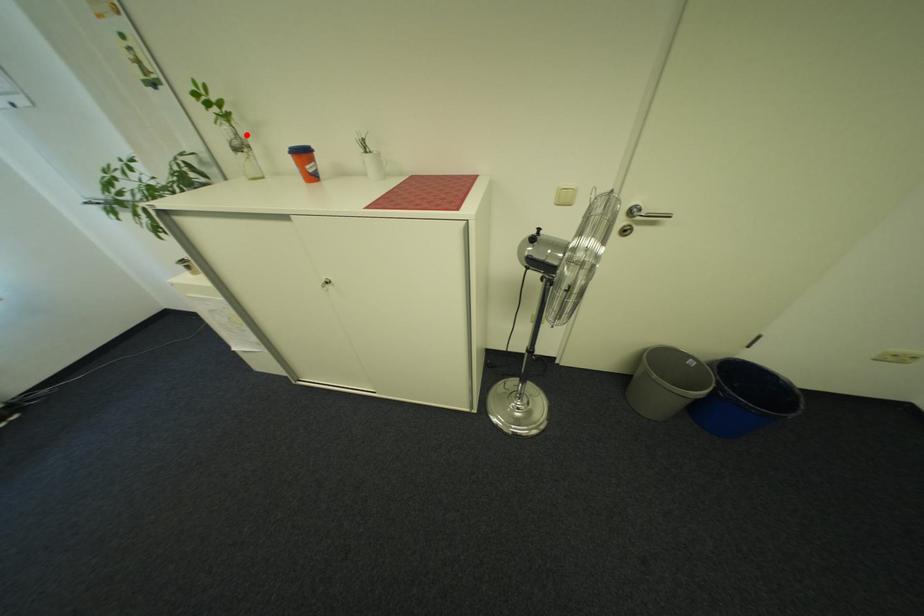
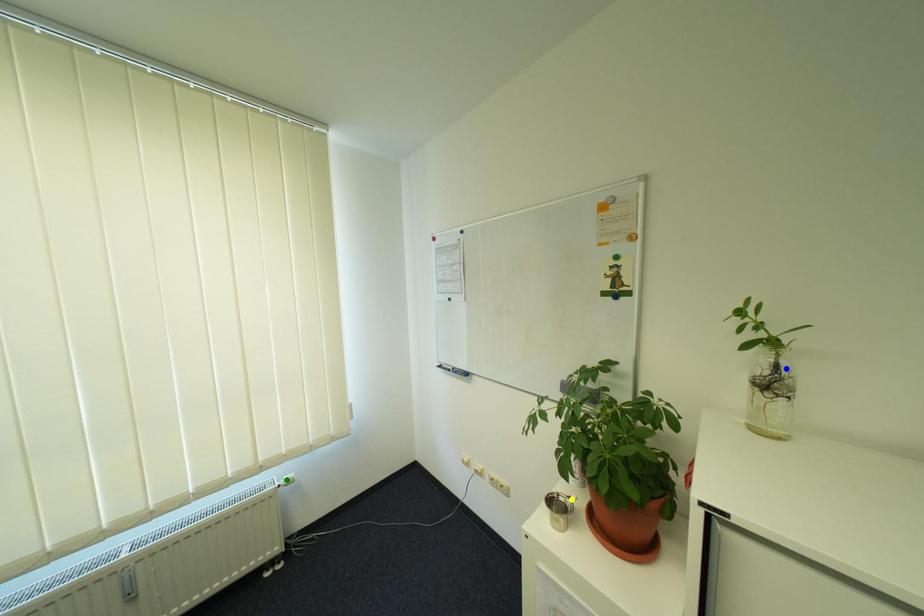
Question: I am providing you with two images of the same scene from different viewpoints. A red point is marked on the first image. You are given multiple points on the second image. In image 2, which mark is for the same physical point as the one in image 1?

Choices:
 (A) blue point
 (B) green point
 (C) yellow point

Answer: (A)